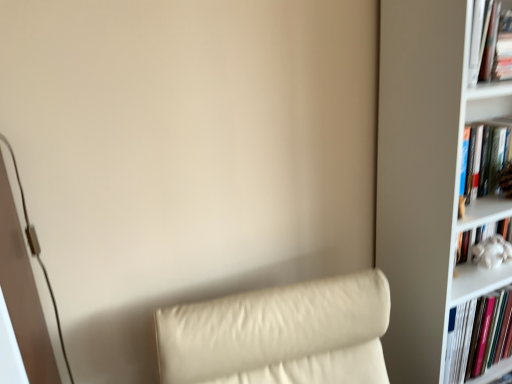
What do you see at coordinates (478, 336) in the screenshot? The image size is (512, 384). I see `hardcover book at right, the 1th book in the bottom-to-top sequence` at bounding box center [478, 336].

In order to face white matte bookcase at right, should I rotate leftwards or rightwards?

Rotate right and turn 29.450 degrees.

How much space does hardcover book at upper right, which is counted as the 4th book, starting from the bottom, occupy vertically?

It is 7.70 inches.

At what (x,y) coordinates should I click in order to perform the action: click on hardcover book at upper right, which is counted as the 4th book, starting from the bottom. Please return your answer as a coordinate pair (x, y). Looking at the image, I should click on (485, 45).

Where is `white fluffy toy at right, the third book from the top`? Image resolution: width=512 pixels, height=384 pixels. white fluffy toy at right, the third book from the top is located at coordinates (484, 242).

The width and height of the screenshot is (512, 384). I want to click on hardcover book at right, the 4th book from the top, so click(x=478, y=336).

Does white matte bookcase at right turn towards hardcover book at right, the third book in the bottom-to-top sequence?

Yes, white matte bookcase at right is oriented towards hardcover book at right, the third book in the bottom-to-top sequence.

Does white matte bookcase at right have a larger size compared to hardcover book at right, the third book in the bottom-to-top sequence?

Correct, white matte bookcase at right is larger in size than hardcover book at right, the third book in the bottom-to-top sequence.

Looking at this image, is white matte bookcase at right beside hardcover book at right, the second book positioned from the top?

They are not placed beside each other.

From the image's perspective, is white matte bookcase at right located above or below hardcover book at right, the second book positioned from the top?

Clearly, from the image's perspective, white matte bookcase at right is below hardcover book at right, the second book positioned from the top.

Which object is more forward, hardcover book at right, the second book positioned from the top, or hardcover book at right, the 4th book from the top?

hardcover book at right, the second book positioned from the top.

Who is smaller, hardcover book at right, the second book positioned from the top, or hardcover book at right, the 4th book from the top?

hardcover book at right, the second book positioned from the top.

Can you tell me how much white matte bookcase at right and hardcover book at right, the 4th book from the top, differ in facing direction?

They differ by 0.258 degrees in their facing directions.

Considering the relative sizes of white matte bookcase at right and hardcover book at right, the 1th book in the bottom-to-top sequence, in the image provided, is white matte bookcase at right shorter than hardcover book at right, the 1th book in the bottom-to-top sequence,?

No, white matte bookcase at right is not shorter than hardcover book at right, the 1th book in the bottom-to-top sequence.

Is white matte bookcase at right wider than hardcover book at right, the 1th book in the bottom-to-top sequence?

Indeed, white matte bookcase at right has a greater width compared to hardcover book at right, the 1th book in the bottom-to-top sequence.

You are a GUI agent. You are given a task and a screenshot of the screen. Output one action in this format:
    pyautogui.click(x=<x>, y=<y>)
    Task: Click on the book below the white matte bookcase at right (from a real-world perspective)
    
    Given the screenshot: What is the action you would take?
    (x=478, y=336)

Is point (493, 37) farther from camera compared to point (424, 377)?

No, (493, 37) is closer to viewer.

Can you see hardcover book at upper right, marked as the first book in a top-to-bottom arrangement, touching white matte bookcase at right?

They are not placed beside each other.

Between hardcover book at upper right, which is counted as the 4th book, starting from the bottom, and white matte bookcase at right, which one has smaller size?

Smaller between the two is hardcover book at upper right, which is counted as the 4th book, starting from the bottom.

From the image's perspective, which one is positioned lower, hardcover book at upper right, marked as the first book in a top-to-bottom arrangement, or white matte bookcase at right?

white matte bookcase at right appears lower in the image.

Consider the image. From a real-world perspective, does hardcover book at right, the 4th book from the top, stand above hardcover book at upper right, which is counted as the 4th book, starting from the bottom?

No, from a real-world perspective, hardcover book at right, the 4th book from the top, is not above hardcover book at upper right, which is counted as the 4th book, starting from the bottom.

Considering the sizes of objects hardcover book at right, the 4th book from the top, and hardcover book at upper right, which is counted as the 4th book, starting from the bottom, in the image provided, who is shorter, hardcover book at right, the 4th book from the top, or hardcover book at upper right, which is counted as the 4th book, starting from the bottom,?

hardcover book at upper right, which is counted as the 4th book, starting from the bottom.

Could hardcover book at upper right, marked as the first book in a top-to-bottom arrangement, be considered to be inside hardcover book at right, the 1th book in the bottom-to-top sequence?

No, hardcover book at upper right, marked as the first book in a top-to-bottom arrangement, is not inside hardcover book at right, the 1th book in the bottom-to-top sequence.

Find the location of a particular element. The width and height of the screenshot is (512, 384). book that is the 3rd object directly below the hardcover book at upper right, marked as the first book in a top-to-bottom arrangement (from a real-world perspective) is located at coordinates (478, 336).

What's the angular difference between hardcover book at right, the second book positioned from the top, and white matte bookcase at right's facing directions?

They differ by 0.102 degrees in their facing directions.

Image resolution: width=512 pixels, height=384 pixels. I want to click on bookcase that appears on the right of hardcover book at right, the second book positioned from the top, so click(x=428, y=178).

Looking at this image, which object is positioned more to the left, hardcover book at right, the third book in the bottom-to-top sequence, or white matte bookcase at right?

Positioned to the left is hardcover book at right, the third book in the bottom-to-top sequence.

Which of these two, hardcover book at right, the second book positioned from the top, or white matte bookcase at right, is thinner?

hardcover book at right, the second book positioned from the top, is thinner.

Could you tell me if hardcover book at upper right, which is counted as the 4th book, starting from the bottom, is turned towards white fluffy toy at right, the second book positioned from the bottom?

No, hardcover book at upper right, which is counted as the 4th book, starting from the bottom, is not facing towards white fluffy toy at right, the second book positioned from the bottom.

In terms of width, does hardcover book at upper right, marked as the first book in a top-to-bottom arrangement, look wider or thinner when compared to white fluffy toy at right, the second book positioned from the bottom?

In the image, hardcover book at upper right, marked as the first book in a top-to-bottom arrangement, appears to be more narrow than white fluffy toy at right, the second book positioned from the bottom.

From a real-world perspective, which book is the 2nd one above the white fluffy toy at right, the second book positioned from the bottom? Please provide its 2D coordinates.

[(485, 45)]

How different are the orientations of hardcover book at upper right, which is counted as the 4th book, starting from the bottom, and white fluffy toy at right, the second book positioned from the bottom, in degrees?

The angle between the facing direction of hardcover book at upper right, which is counted as the 4th book, starting from the bottom, and the facing direction of white fluffy toy at right, the second book positioned from the bottom, is 0.158 degrees.

The width and height of the screenshot is (512, 384). In order to click on the 2nd book directly above the white matte bookcase at right (from a real-world perspective) in this screenshot , I will do `click(483, 161)`.

Image resolution: width=512 pixels, height=384 pixels. In order to click on the 2nd book directly beneath the hardcover book at right, the third book in the bottom-to-top sequence (from a real-world perspective) in this screenshot , I will do `click(478, 336)`.

Considering their positions, is hardcover book at upper right, marked as the first book in a top-to-bottom arrangement, positioned closer to hardcover book at right, the 1th book in the bottom-to-top sequence, than white matte bookcase at right?

white matte bookcase at right is positioned closer to the anchor hardcover book at right, the 1th book in the bottom-to-top sequence.

Based on their spatial positions, is hardcover book at right, the 4th book from the top, or hardcover book at right, the third book in the bottom-to-top sequence, further from white fluffy toy at right, the third book from the top?

Based on the image, hardcover book at right, the 4th book from the top, appears to be further to white fluffy toy at right, the third book from the top.

Estimate the real-world distances between objects in this image. Which object is closer to white fluffy toy at right, the third book from the top, white matte bookcase at right or hardcover book at right, the 4th book from the top?

The object closer to white fluffy toy at right, the third book from the top, is hardcover book at right, the 4th book from the top.

Looking at the image, which one is located further to hardcover book at right, the third book in the bottom-to-top sequence, white matte bookcase at right or white fluffy toy at right, the second book positioned from the bottom?

white matte bookcase at right.

Based on their spatial positions, is hardcover book at upper right, which is counted as the 4th book, starting from the bottom, or white matte bookcase at right further from hardcover book at right, the second book positioned from the top?

hardcover book at upper right, which is counted as the 4th book, starting from the bottom, lies further to hardcover book at right, the second book positioned from the top, than the other object.

Looking at the image, which one is located closer to white matte bookcase at right, hardcover book at right, the 1th book in the bottom-to-top sequence, or hardcover book at right, the second book positioned from the top?

hardcover book at right, the second book positioned from the top, is positioned closer to the anchor white matte bookcase at right.

Estimate the real-world distances between objects in this image. Which object is closer to white fluffy toy at right, the third book from the top, hardcover book at upper right, which is counted as the 4th book, starting from the bottom, or white matte bookcase at right?

white matte bookcase at right lies closer to white fluffy toy at right, the third book from the top, than the other object.

Looking at the image, which one is located further to hardcover book at right, the second book positioned from the top, hardcover book at right, the 1th book in the bottom-to-top sequence, or white matte bookcase at right?

Among the two, hardcover book at right, the 1th book in the bottom-to-top sequence, is located further to hardcover book at right, the second book positioned from the top.

Where is `book that lies between hardcover book at right, the third book in the bottom-to-top sequence, and white matte bookcase at right from top to bottom`? This screenshot has height=384, width=512. book that lies between hardcover book at right, the third book in the bottom-to-top sequence, and white matte bookcase at right from top to bottom is located at coordinates (484, 242).

This screenshot has width=512, height=384. I want to click on book between hardcover book at right, the third book in the bottom-to-top sequence, and hardcover book at right, the 1th book in the bottom-to-top sequence, in the vertical direction, so click(x=484, y=242).

You are a GUI agent. You are given a task and a screenshot of the screen. Output one action in this format:
    pyautogui.click(x=<x>, y=<y>)
    Task: Click on the book that lies between hardcover book at upper right, marked as the first book in a top-to-bottom arrangement, and white fluffy toy at right, the second book positioned from the bottom, from top to bottom
    The height and width of the screenshot is (384, 512).
    Given the screenshot: What is the action you would take?
    pyautogui.click(x=483, y=161)

Identify the location of bookcase that lies between hardcover book at right, the third book in the bottom-to-top sequence, and hardcover book at right, the 1th book in the bottom-to-top sequence, from top to bottom. Image resolution: width=512 pixels, height=384 pixels. (428, 178).